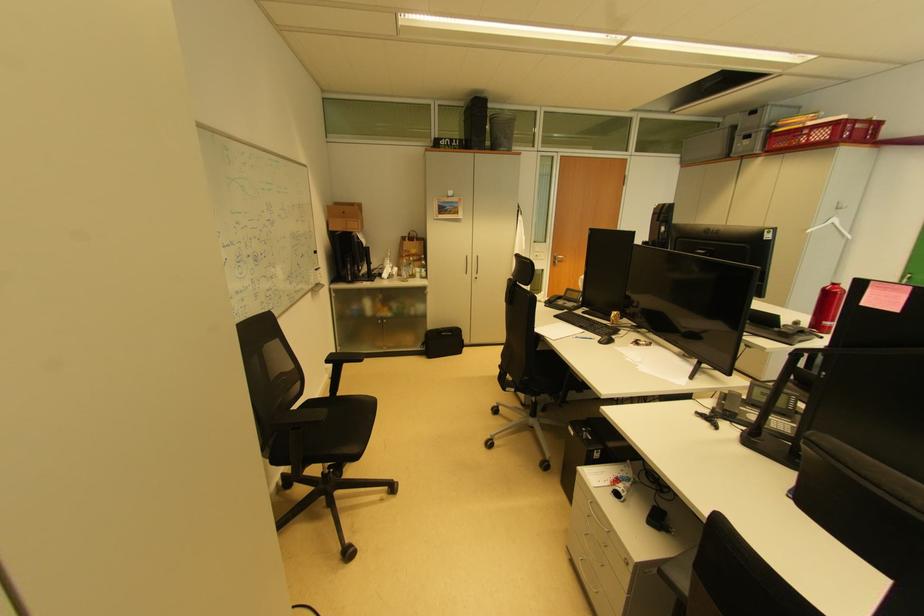
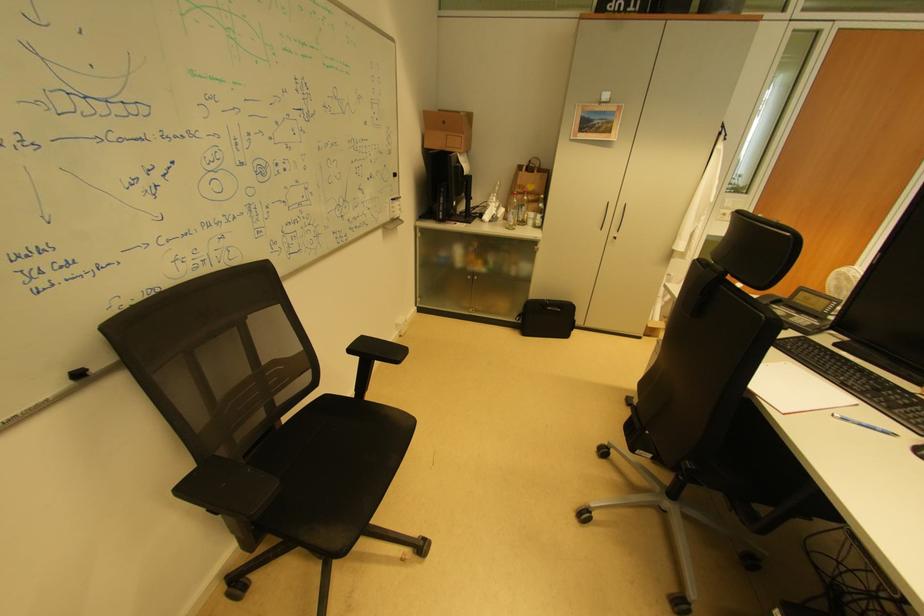
Find the pixel in the second image that matches point (353, 214) in the first image.

(453, 124)